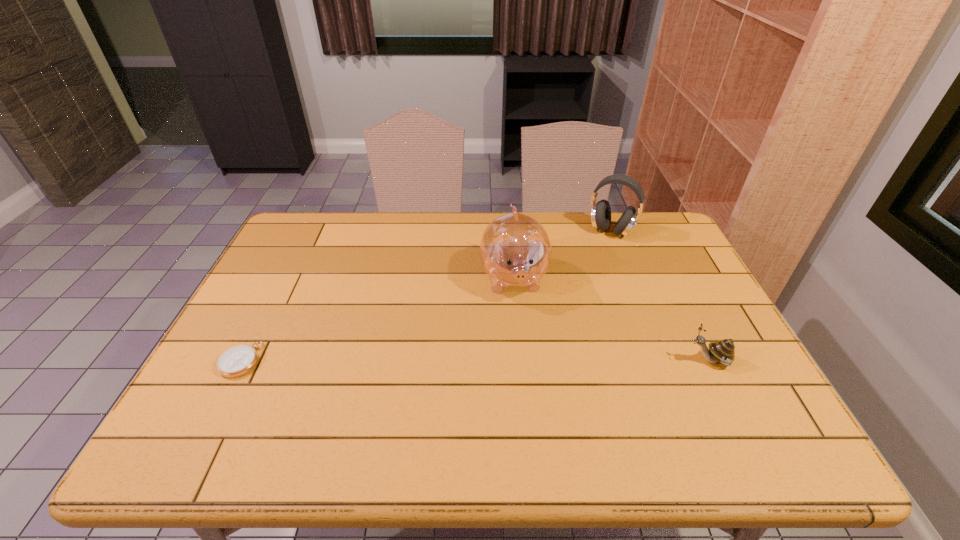
Identify the location of free region that satisfies the following two spatial constraints: 1. on the front side of the second farthest object; 2. on the face of the second shortest object. (521, 360).

Identify the location of free space that satisfies the following two spatial constraints: 1. on the front side of the shortest object; 2. on the face of the second shortest object. The height and width of the screenshot is (540, 960). (241, 360).

Identify the location of blank area in the image that satisfies the following two spatial constraints: 1. on the front side of the second shortest object; 2. on the face of the piggy bank. This screenshot has height=540, width=960. (521, 360).

Locate an element on the screen. The image size is (960, 540). free location that satisfies the following two spatial constraints: 1. on the back side of the farthest object; 2. on the right side of the leftmost object is located at coordinates (307, 231).